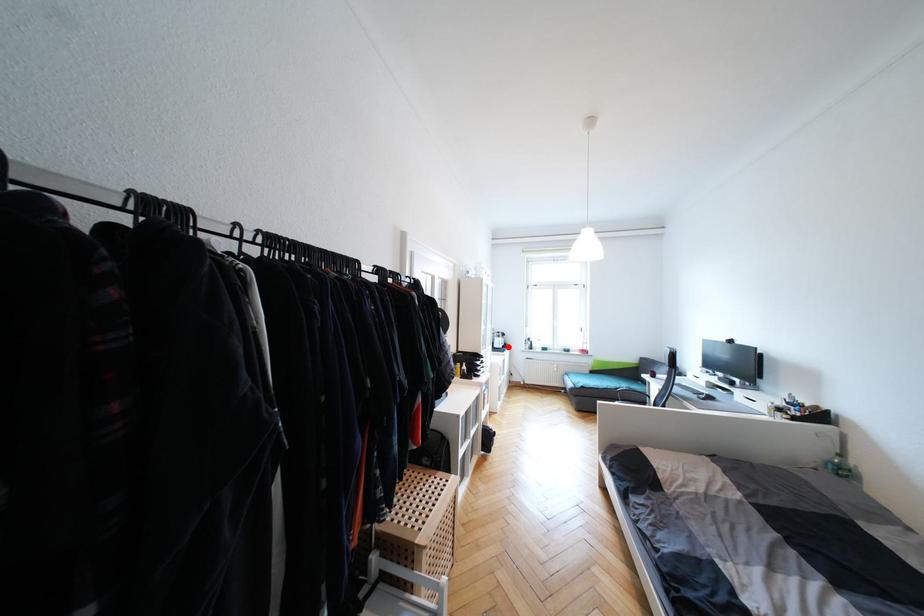
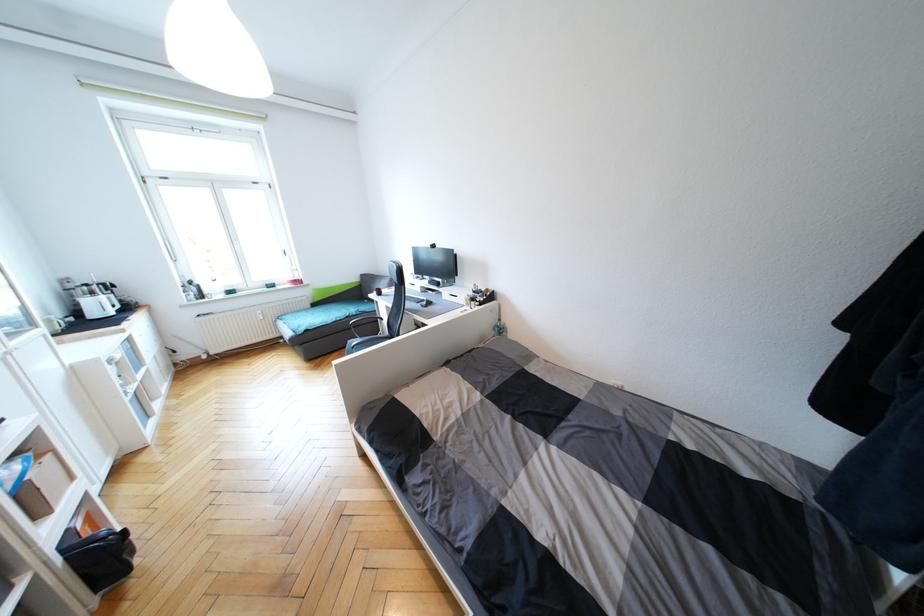
Question: I am providing you with two images of the same scene from different viewpoints. A red point is shown in image1. For the corresponding object point in image2, is it positioned nearer or farther from the camera?

Choices:
 (A) Nearer
 (B) Farther

Answer: (A)